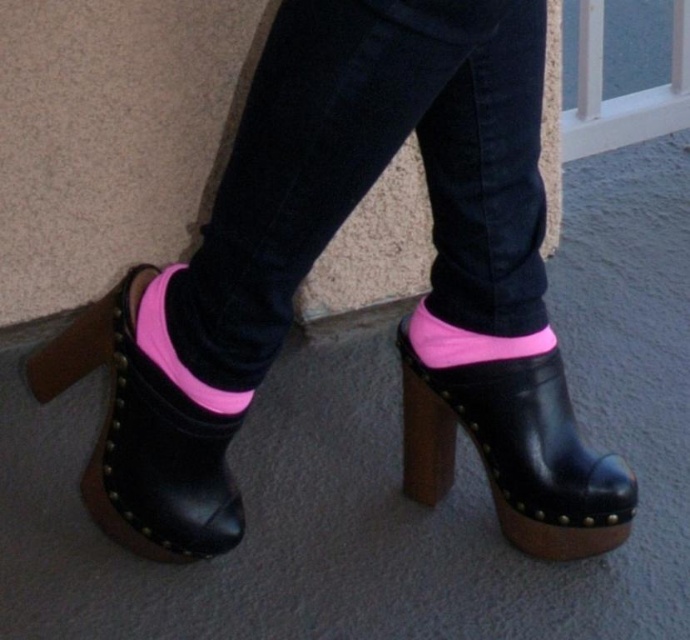
Can you confirm if black denim jeans at center is positioned to the right of neon pink fabric sock at lower center?

No, black denim jeans at center is not to the right of neon pink fabric sock at lower center.

Who is shorter, black denim jeans at center or neon pink fabric sock at lower center?

neon pink fabric sock at lower center

Measure the distance between point (453, 232) and camera.

Point (453, 232) is 4.00 feet from camera.

The height and width of the screenshot is (640, 690). In order to click on black denim jeans at center in this screenshot , I will do pyautogui.click(x=374, y=170).

Measure the distance from black leather clog at lower right to pink fabric sock at lower center.

black leather clog at lower right is 42.84 centimeters from pink fabric sock at lower center.

Does black leather clog at lower right have a larger size compared to pink fabric sock at lower center?

Yes, black leather clog at lower right is bigger than pink fabric sock at lower center.

The height and width of the screenshot is (640, 690). Identify the location of black leather clog at lower right. (513, 451).

Is black leather clog at lower right to the left of leather high-heeled sandal at lower left from the viewer's perspective?

Incorrect, black leather clog at lower right is not on the left side of leather high-heeled sandal at lower left.

Can you confirm if black leather clog at lower right is taller than leather high-heeled sandal at lower left?

No, black leather clog at lower right is not taller than leather high-heeled sandal at lower left.

Does point (495, 387) come in front of point (206, 474)?

No, it is behind (206, 474).

This screenshot has width=690, height=640. In order to click on black leather clog at lower right in this screenshot , I will do `click(513, 451)`.